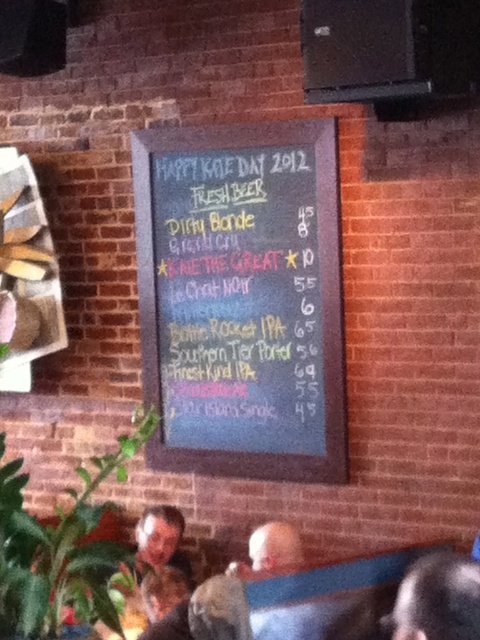
How much distance is there between dark brown hair at lower right and gray fabric shirt at lower center?

A distance of 32.81 inches exists between dark brown hair at lower right and gray fabric shirt at lower center.

Does point (415, 589) come farther from viewer compared to point (282, 544)?

No, it is not.

Where is `dark brown hair at lower right`? Image resolution: width=480 pixels, height=640 pixels. dark brown hair at lower right is located at coordinates (437, 600).

Does black chalkboard at center have a smaller size compared to gray fabric shirt at lower center?

Incorrect, black chalkboard at center is not smaller in size than gray fabric shirt at lower center.

Is black chalkboard at center above gray fabric shirt at lower center?

Correct, black chalkboard at center is located above gray fabric shirt at lower center.

Locate an element on the screen. Image resolution: width=480 pixels, height=640 pixels. black chalkboard at center is located at coordinates (x=241, y=298).

Who is higher up, black chalkboard at center or dark brown hair at lower right?

black chalkboard at center is above.

Is black chalkboard at center to the right of dark brown hair at lower right from the viewer's perspective?

Incorrect, black chalkboard at center is not on the right side of dark brown hair at lower right.

Is point (155, 378) farther from camera compared to point (479, 627)?

Yes.

The width and height of the screenshot is (480, 640). What are the coordinates of `black chalkboard at center` in the screenshot? It's located at (241, 298).